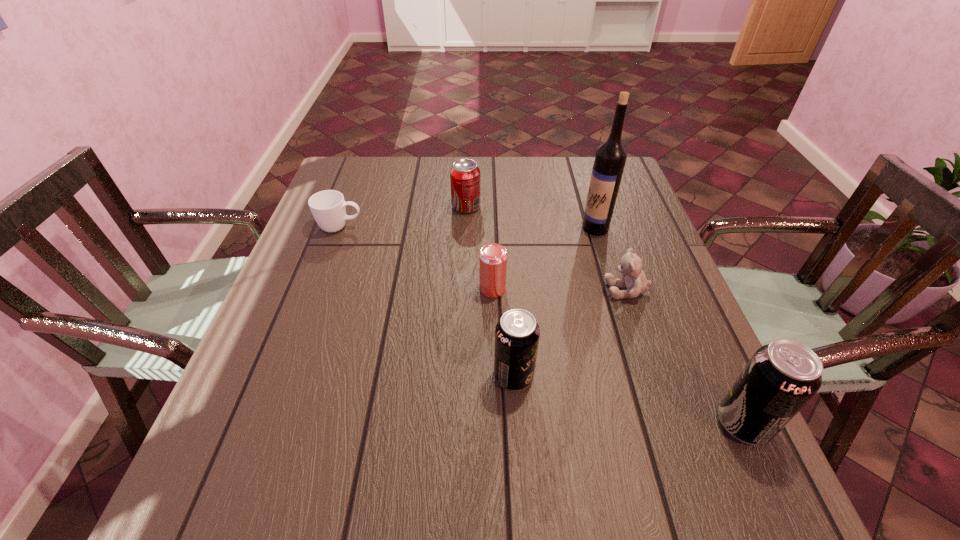
What are the coordinates of `the third tallest object` in the screenshot? It's located at point(517,333).

The height and width of the screenshot is (540, 960). I want to click on the second nearest object, so click(517, 333).

At what (x,y) coordinates should I click in order to perform the action: click on the nearest object. Please return your answer as a coordinate pair (x, y). The image size is (960, 540). Looking at the image, I should click on click(x=780, y=378).

Locate an element on the screen. This screenshot has height=540, width=960. the tallest soda can is located at coordinates (780, 378).

Identify the location of the farthest soda can. (465, 174).

Image resolution: width=960 pixels, height=540 pixels. I want to click on the farthest object, so click(465, 174).

The width and height of the screenshot is (960, 540). What are the coordinates of `the leftmost object` in the screenshot? It's located at (328, 207).

Where is `wine bottle`? This screenshot has height=540, width=960. wine bottle is located at coordinates (611, 155).

Locate an element on the screen. The height and width of the screenshot is (540, 960). teddy bear is located at coordinates (630, 266).

Where is `beer can`? The height and width of the screenshot is (540, 960). beer can is located at coordinates (493, 257).